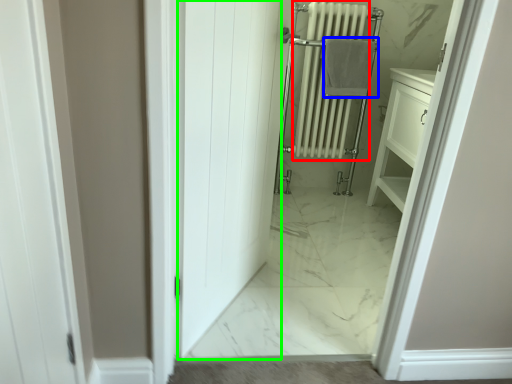
Question: Estimate the real-world distances between objects in this image. Which object is closer to radiator (highlighted by a red box), bath towel (highlighted by a blue box) or door (highlighted by a green box)?

Choices:
 (A) bath towel
 (B) door

Answer: (A)